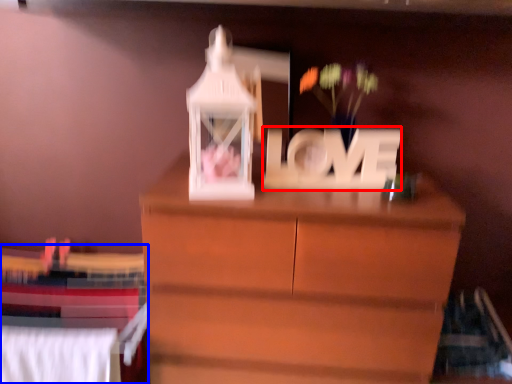
Question: Which point is closer to the camera, letter (highlighted by a red box) or bed (highlighted by a blue box)?

Choices:
 (A) letter
 (B) bed

Answer: (A)